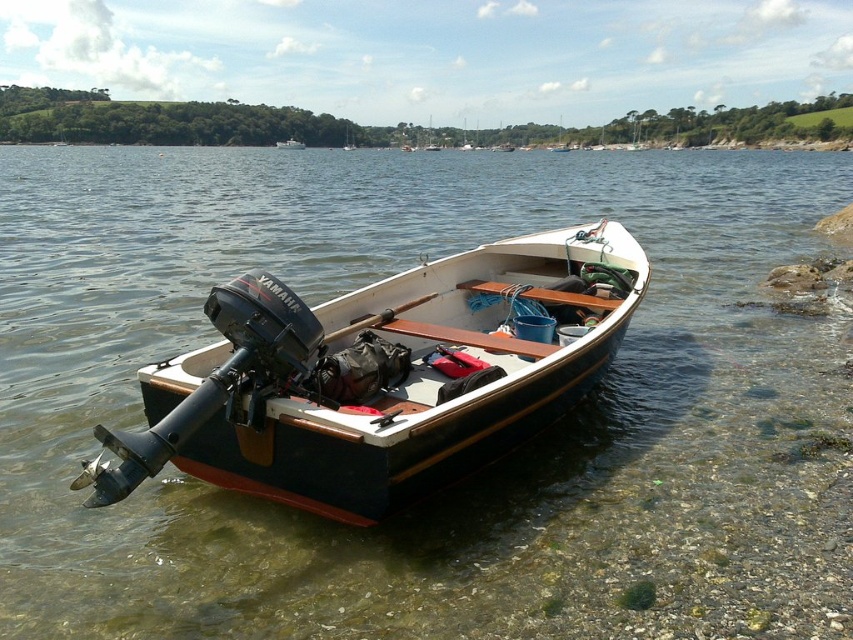
Between point (318, 493) and point (289, 147), which one is positioned in front?

Positioned in front is point (318, 493).

This screenshot has height=640, width=853. I want to click on wooden boat at center, so click(x=386, y=380).